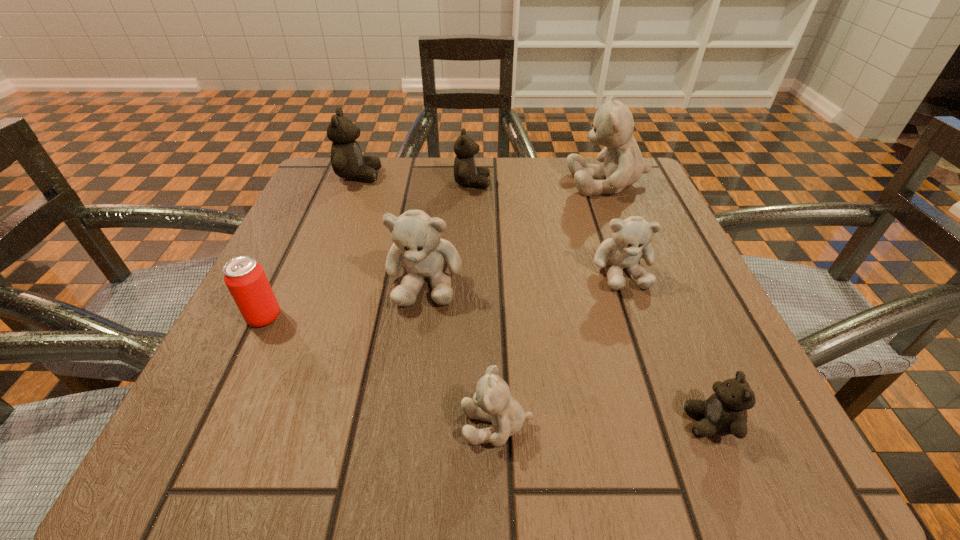
Locate an element on the screen. the farthest gray teddy bear is located at coordinates (623, 164).

This screenshot has width=960, height=540. In order to click on the tallest teddy bear in this screenshot , I will do `click(623, 164)`.

Locate an element on the screen. the leftmost brown teddy bear is located at coordinates (347, 161).

The width and height of the screenshot is (960, 540). I want to click on the biggest brown teddy bear, so click(347, 161).

Locate an element on the screen. the leftmost gray teddy bear is located at coordinates (418, 248).

Identify the location of the second brown teddy bear from right to left. The width and height of the screenshot is (960, 540). (466, 173).

I want to click on the third biggest gray teddy bear, so click(631, 237).

Locate an element on the screen. The image size is (960, 540). beer can is located at coordinates (245, 279).

What are the coordinates of `the smallest brown teddy bear` in the screenshot? It's located at (725, 412).

The height and width of the screenshot is (540, 960). What are the coordinates of `the rightmost brown teddy bear` in the screenshot? It's located at (725, 412).